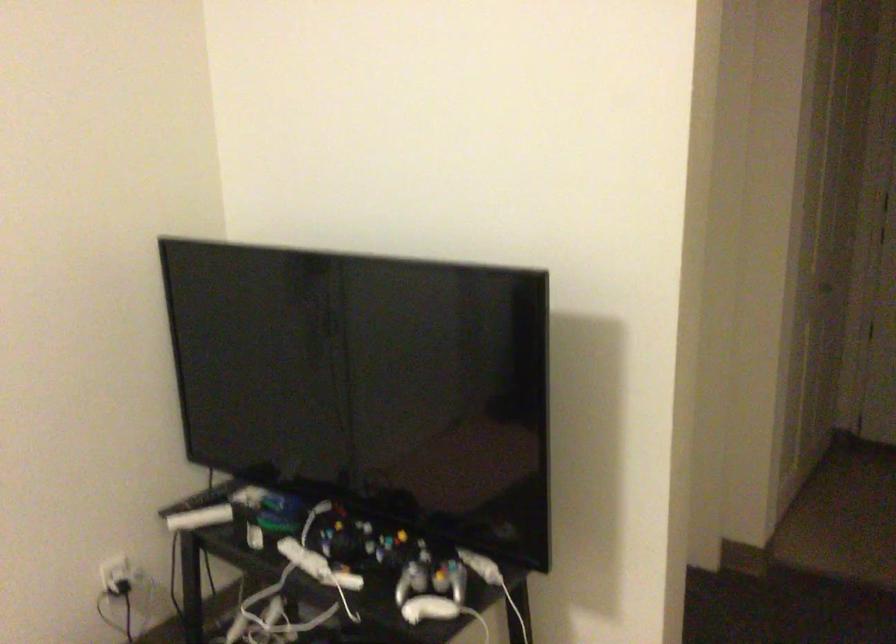
Question: The images are taken continuously from a first-person perspective. In which direction is your viewpoint rotating?

Choices:
 (A) Left
 (B) Right
 (C) Up
 (D) Down

Answer: (B)